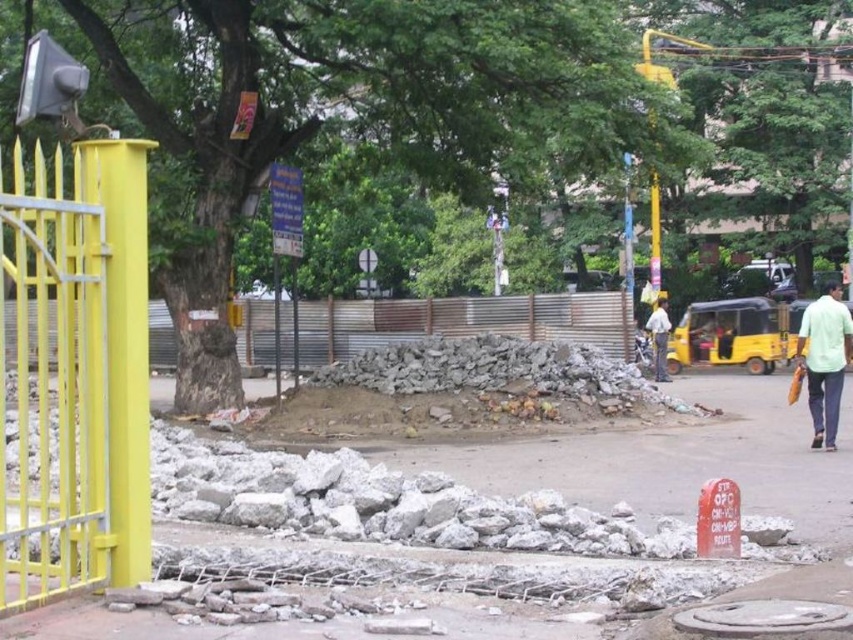
Between point (384, 449) and point (654, 307), which one is positioned in front?

Point (384, 449)

The width and height of the screenshot is (853, 640). Find the location of `gray concrete pavement at center`. gray concrete pavement at center is located at coordinates (672, 460).

Does gray concrete pavement at center lie in front of light green shirt at right?

Yes, gray concrete pavement at center is in front of light green shirt at right.

Is point (251, 385) closer to camera compared to point (825, 291)?

That is True.

Which is behind, point (264, 381) or point (822, 385)?

The point (264, 381) is behind.

At what (x,y) coordinates should I click in order to perform the action: click on gray concrete pavement at center. Please return your answer as a coordinate pair (x, y). Looking at the image, I should click on (672, 460).

Can you confirm if corrugated metal fence at center is bigger than light green shirt at right?

No, corrugated metal fence at center is not bigger than light green shirt at right.

Who is shorter, corrugated metal fence at center or light green shirt at right?

corrugated metal fence at center

Is point (160, 364) more distant than point (808, 317)?

Yes, point (160, 364) is behind point (808, 317).

Find the location of a particular element. Image resolution: width=853 pixels, height=640 pixels. corrugated metal fence at center is located at coordinates (463, 321).